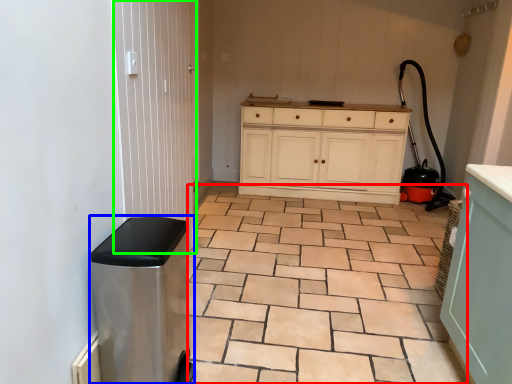
Question: Which object is the closest to the ceramic tile (highlighted by a red box)? Choose among these: water heater (highlighted by a blue box) or screen door (highlighted by a green box).

Choices:
 (A) water heater
 (B) screen door

Answer: (A)